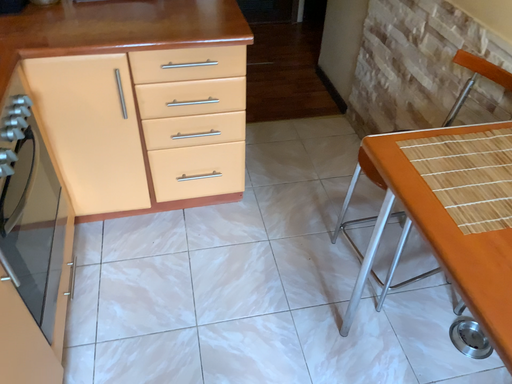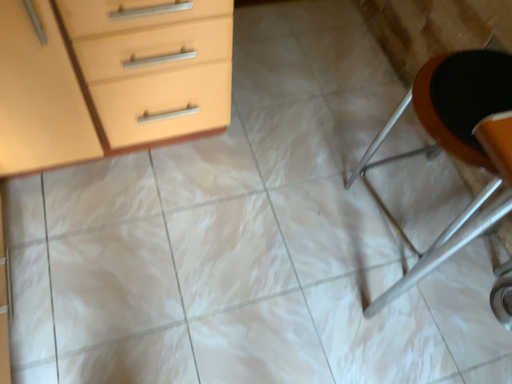
Question: How did the camera likely rotate when shooting the video?

Choices:
 (A) rotated upward
 (B) rotated downward

Answer: (B)